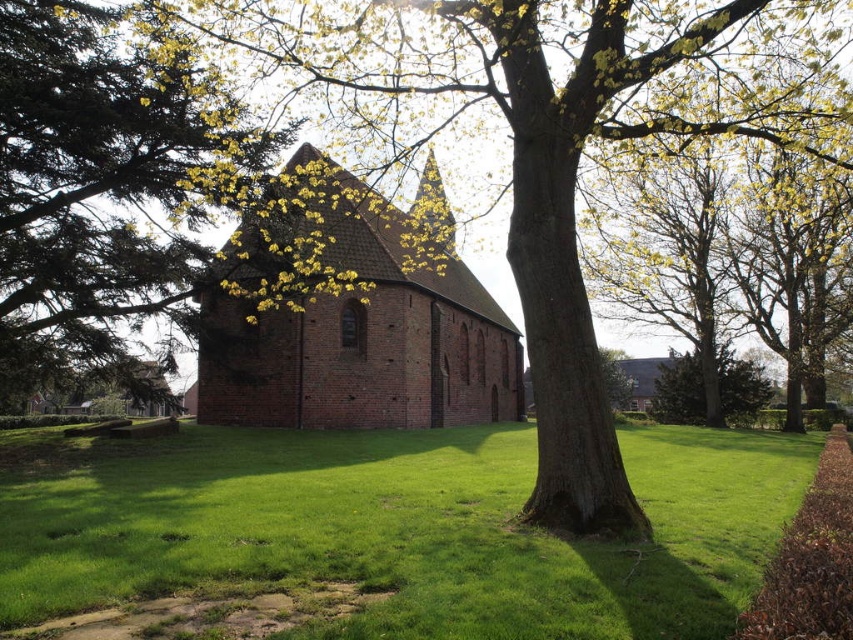
Question: Is smooth bark tree at center bigger than brick church at center?

Choices:
 (A) no
 (B) yes

Answer: (B)

Question: Is green grass at center positioned at the back of green leafy tree at center?

Choices:
 (A) yes
 (B) no

Answer: (B)

Question: Does green grass at center have a smaller size compared to brick church at center?

Choices:
 (A) yes
 (B) no

Answer: (A)

Question: Which point is farther from the camera taking this photo?

Choices:
 (A) (120, 486)
 (B) (35, 6)

Answer: (B)

Question: Based on their relative distances, which object is farther from the smooth bark tree at center?

Choices:
 (A) brick church at center
 (B) green grass at center
 (C) green leafy tree at center

Answer: (B)

Question: Estimate the real-world distances between objects in this image. Which object is closer to the green grass at center?

Choices:
 (A) brick church at center
 (B) smooth bark tree at center
 (C) green leafy tree at center

Answer: (C)